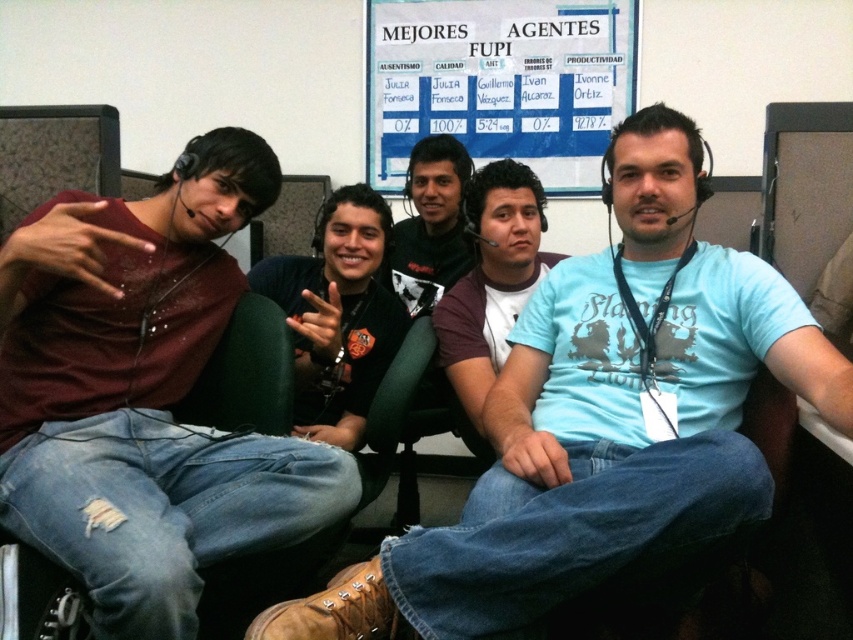
You are a new employee in this office and need to locate the white paper at upper center. Based on the scene description, where should you look?

The white paper at upper center is located at point (498, 83).

You are a new employee in the office and need to hand a document to the person wearing the matte maroon shirt at left. You are currently standing in front of the white paper at upper center. Can you directly hand the document to them without moving around any obstacles?

The matte maroon shirt at left is closer to the viewer than the white paper at upper center. Since the person is closer, you can directly hand the document to them without needing to move around any obstacles.

You are an office manager checking the layout of the workspace. You see the white paper at upper center and the maroon fabric shirt at center. Which object is closer to you?

The white paper at upper center is closer to you because it is further to the viewer than the maroon fabric shirt at center.